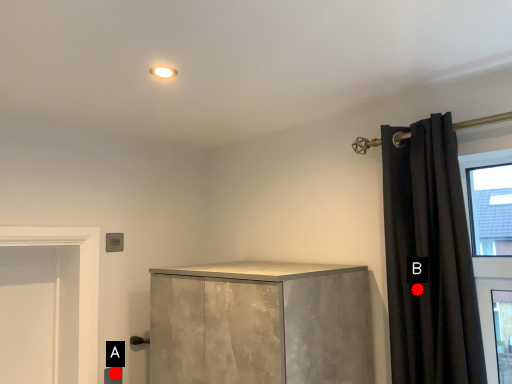
Question: Two points are circled on the image, labeled by A and B beside each circle. Which point appears closest to the camera in this image?

Choices:
 (A) A is closer
 (B) B is closer

Answer: (B)